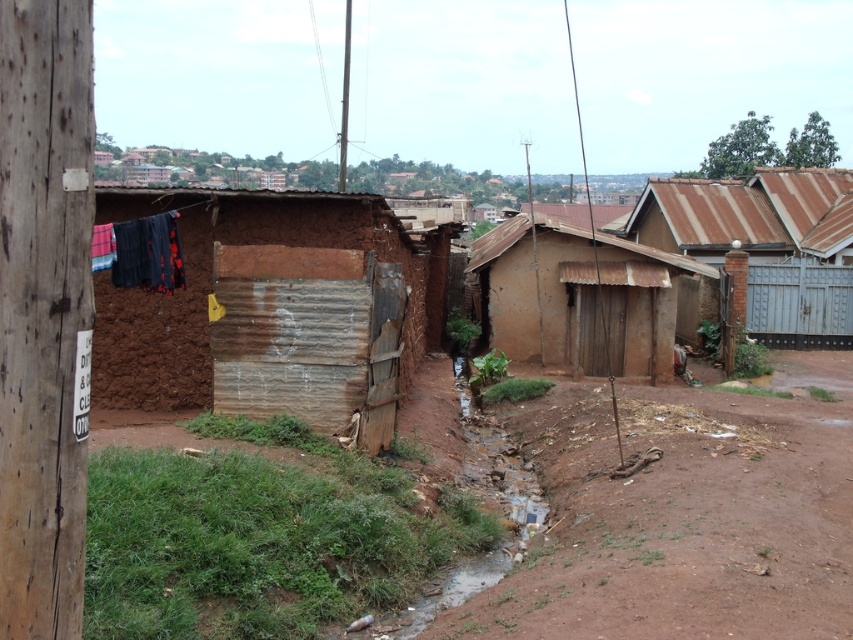
You are a delivery person trying to navigate through the area. You need to deliver a package to the structure on the right. The path is narrow and the stream might be tricky. Considering the brown dirt field at center and the brushed metal telegraph pole at upper center, which one is closer to you as you stand at the starting point?

The brown dirt field at center is closer to the viewer than the brushed metal telegraph pole at upper center, so you would encounter the brown dirt field at center first when moving forward from your starting position.